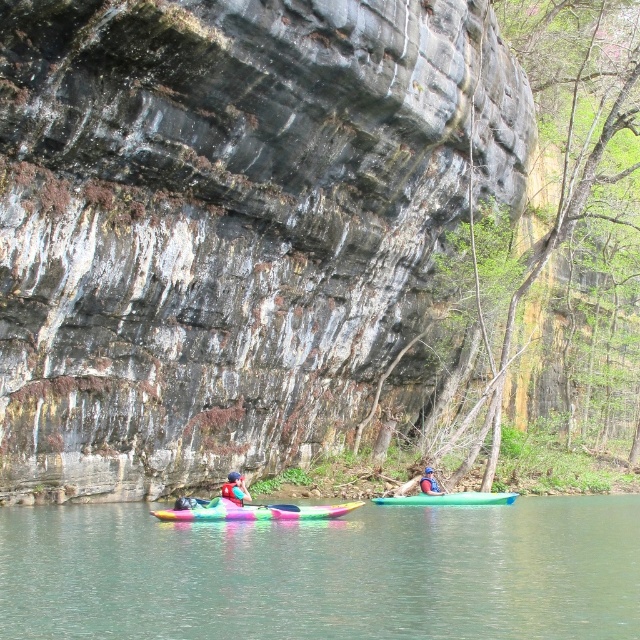
Looking at this image, can you confirm if rainbow plastic kayak at center is positioned to the left of rubber paddle at center?

In fact, rainbow plastic kayak at center is to the right of rubber paddle at center.

What do you see at coordinates (252, 512) in the screenshot? The image size is (640, 640). I see `rainbow plastic kayak at center` at bounding box center [252, 512].

This screenshot has width=640, height=640. Find the location of `rainbow plastic kayak at center`. rainbow plastic kayak at center is located at coordinates (252, 512).

At what (x,y) coordinates should I click in order to perform the action: click on rainbow plastic kayak at center. Please return your answer as a coordinate pair (x, y). Looking at the image, I should click on (252, 512).

Which is below, matte pink kayak at center or rubber paddle at center?

rubber paddle at center is below.

From the picture: Is matte pink kayak at center below rubber paddle at center?

Actually, matte pink kayak at center is above rubber paddle at center.

At what (x,y) coordinates should I click in order to perform the action: click on matte pink kayak at center. Please return your answer as a coordinate pair (x, y). The width and height of the screenshot is (640, 640). Looking at the image, I should click on [236, 488].

Does dark gray stone cliff at center appear on the right side of matte pink kayak at center?

Yes, dark gray stone cliff at center is to the right of matte pink kayak at center.

Which is behind, point (93, 177) or point (228, 490)?

Point (93, 177)

The width and height of the screenshot is (640, 640). I want to click on dark gray stone cliff at center, so click(225, 224).